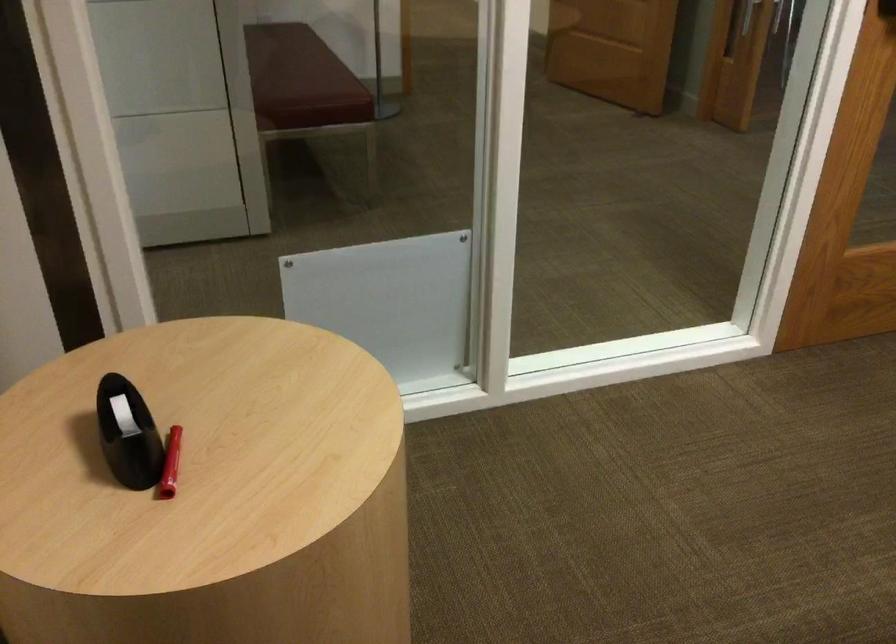
What do you see at coordinates (300, 79) in the screenshot? The image size is (896, 644). I see `the sofa sitting surface` at bounding box center [300, 79].